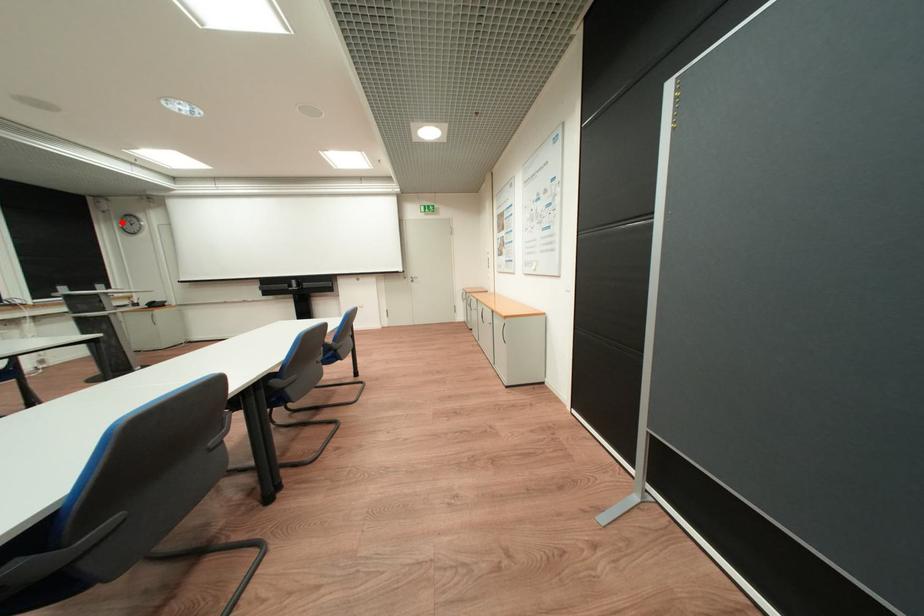
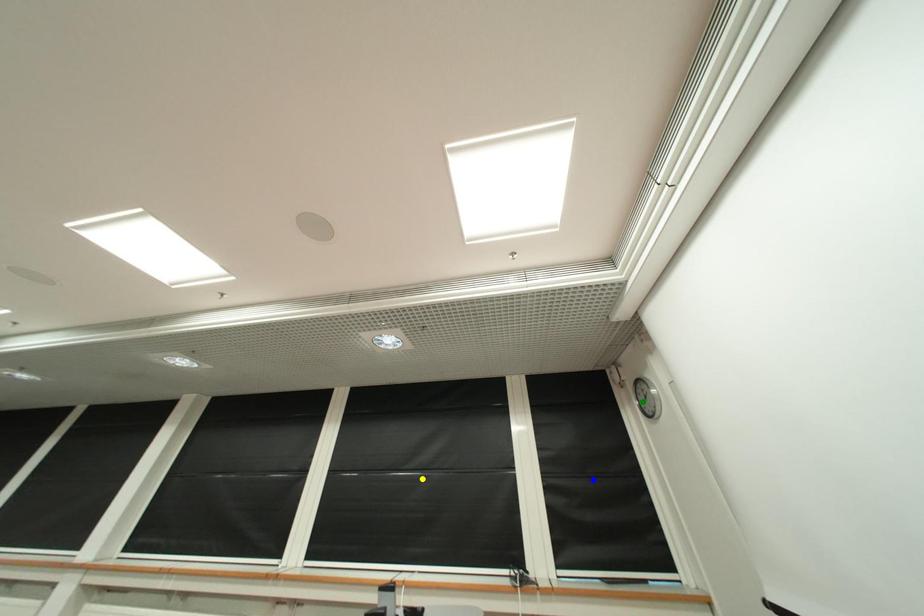
Question: I am providing you with two images of the same scene from different viewpoints. A red point is marked on the first image. You are given multiple points on the second image. Which spot in image 2 lines up with the point in image 1?

Choices:
 (A) green point
 (B) yellow point
 (C) blue point

Answer: (A)